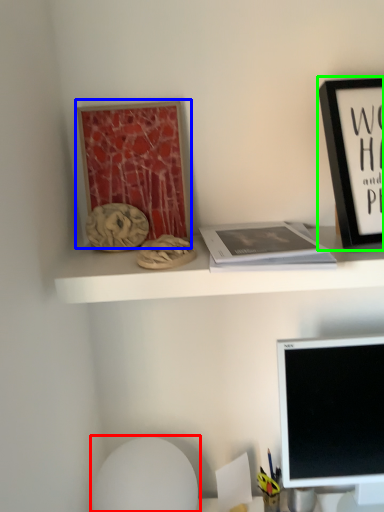
Question: Considering the real-world distances, which object is closest to swivel chair (highlighted by a red box)? bulletin board (highlighted by a blue box) or picture frame (highlighted by a green box).

Choices:
 (A) bulletin board
 (B) picture frame

Answer: (A)